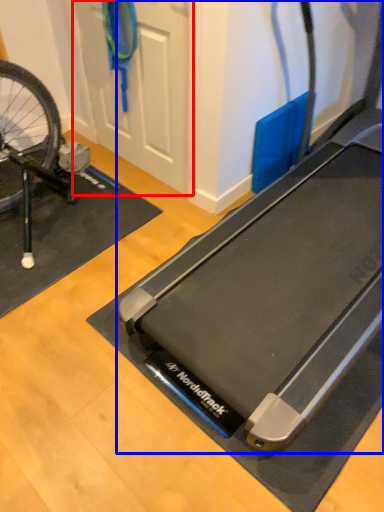
Question: Which object is closer to the camera taking this photo, door (highlighted by a red box) or treadmill (highlighted by a blue box)?

Choices:
 (A) door
 (B) treadmill

Answer: (B)